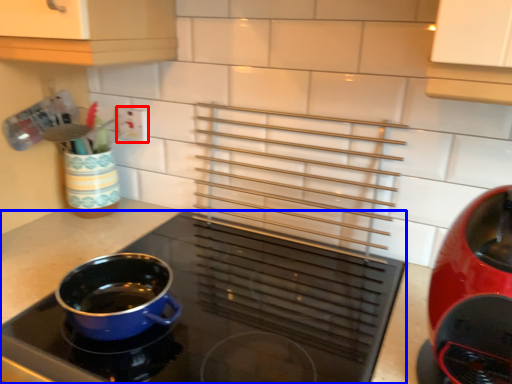
Question: Which object is closer to the camera taking this photo, electric outlet (highlighted by a red box) or kitchen appliance (highlighted by a blue box)?

Choices:
 (A) electric outlet
 (B) kitchen appliance

Answer: (B)